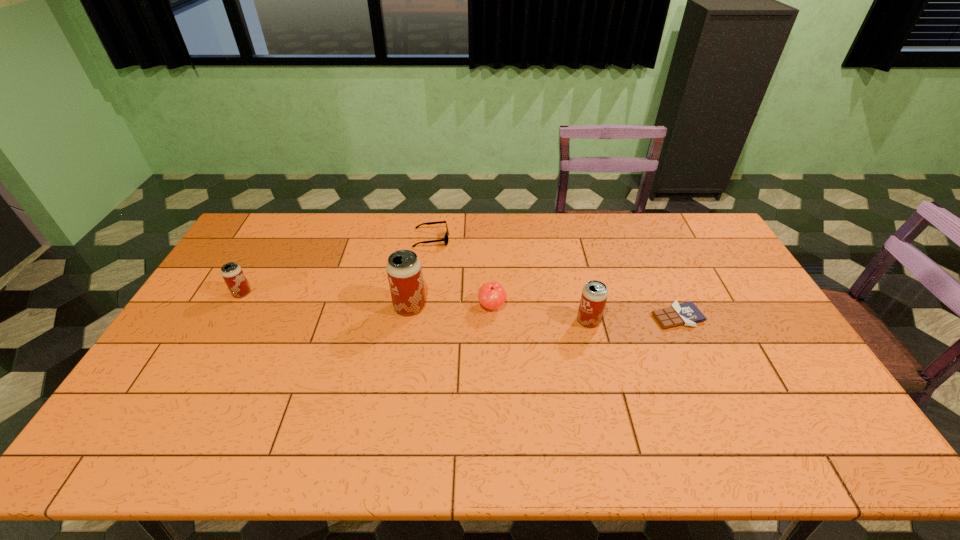
Locate an element on the screen. This screenshot has width=960, height=540. vacant position in the image that satisfies the following two spatial constraints: 1. on the front-facing side of the farthest object; 2. on the right side of the third object from right to left is located at coordinates (422, 306).

This screenshot has height=540, width=960. Identify the location of vacant space that satisfies the following two spatial constraints: 1. on the front side of the second tallest beer can; 2. on the right side of the shortest beer can. (227, 321).

Find the location of a particular element. vacant point that satisfies the following two spatial constraints: 1. on the back side of the second object from right to left; 2. on the right side of the rightmost object is located at coordinates (588, 316).

Locate an element on the screen. This screenshot has width=960, height=540. free point that satisfies the following two spatial constraints: 1. on the front-facing side of the sunglasses; 2. on the right side of the shortest object is located at coordinates coord(420,316).